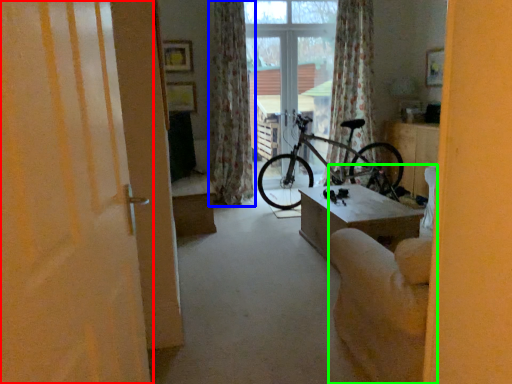
Question: Which object is positioned farthest from door (highlighted by a red box)? Select from curtain (highlighted by a blue box) and armchair (highlighted by a green box).

Choices:
 (A) curtain
 (B) armchair

Answer: (A)